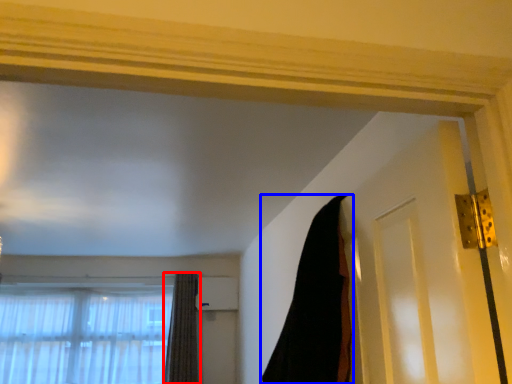
Question: Among these objects, which one is farthest to the camera, curtain (highlighted by a red box) or curtain (highlighted by a blue box)?

Choices:
 (A) curtain
 (B) curtain

Answer: (A)